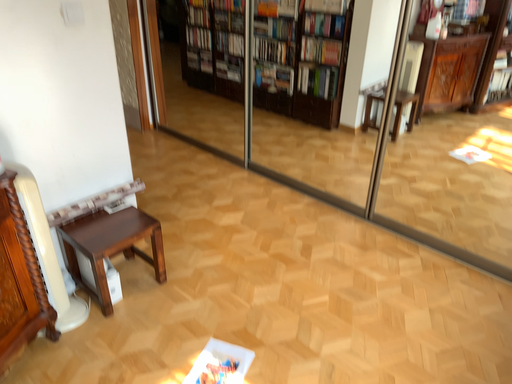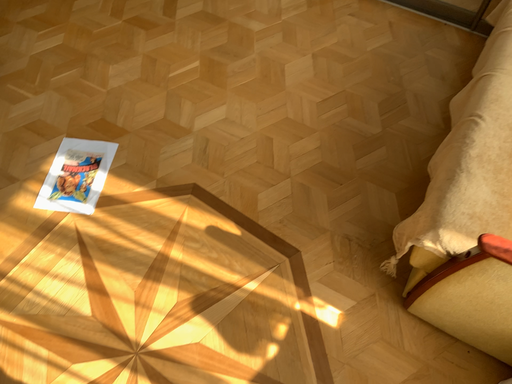
Question: Which way did the camera rotate in the video?

Choices:
 (A) rotated left
 (B) rotated right

Answer: (B)